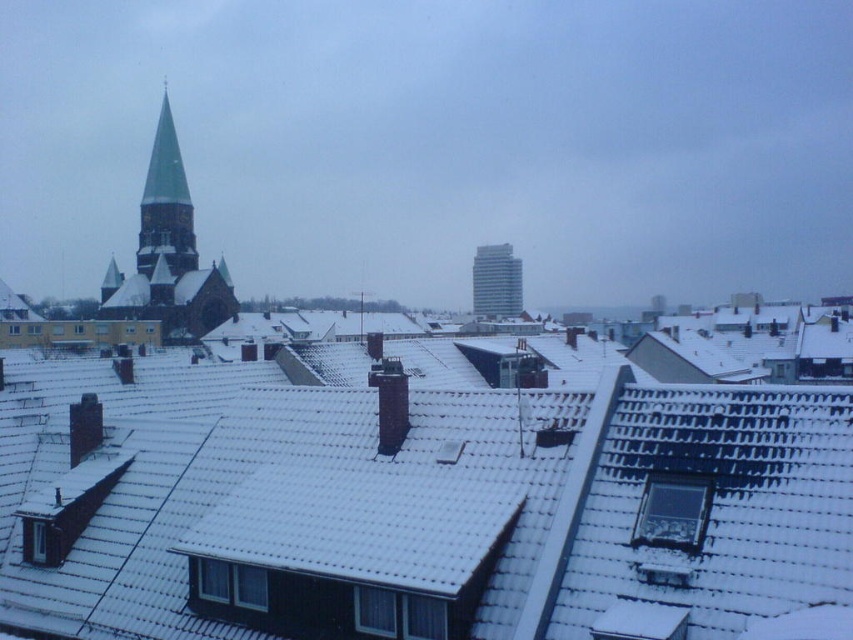
You are a bird flying over the snowy rooftops. You see the white glassy tower at center and the smooth gray chimney at center. Which one is higher up in the sky?

The white glassy tower at center is located above the smooth gray chimney at center, so it is higher up in the sky.

You are standing in the winter scene looking at the rooftops. There are two points marked as point 1 at coordinates (498, 296) and point 2 at coordinates (390, 387). Which point is closer to you?

Point 1 at coordinates (498, 296) is closer to you because it is further to the camera than point 2 at coordinates (390, 387).